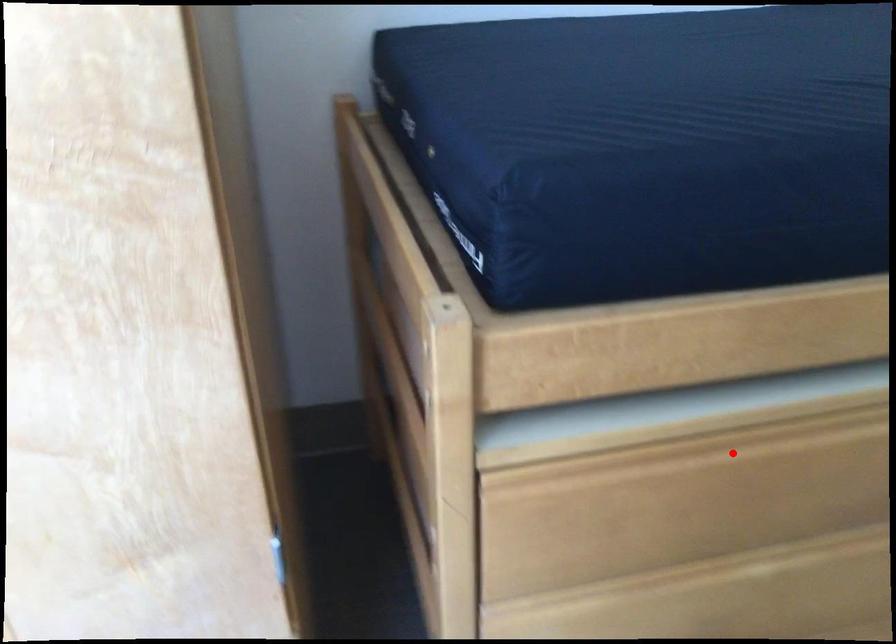
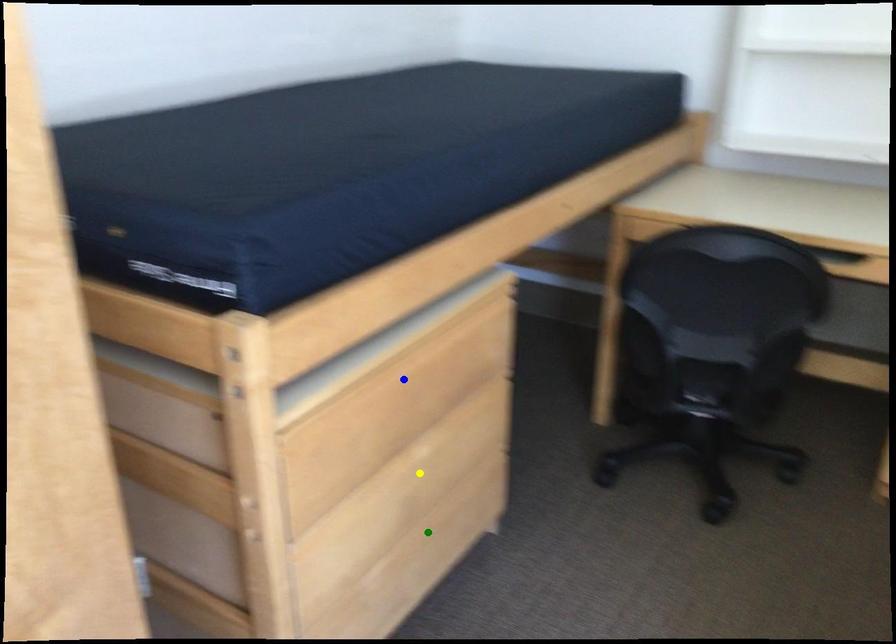
Question: I am providing you with two images of the same scene from different viewpoints. A red point is marked on the first image. You are given multiple points on the second image. Which point in image 2 represents the same 3d spot as the red point in image 1?

Choices:
 (A) blue point
 (B) yellow point
 (C) green point

Answer: (A)